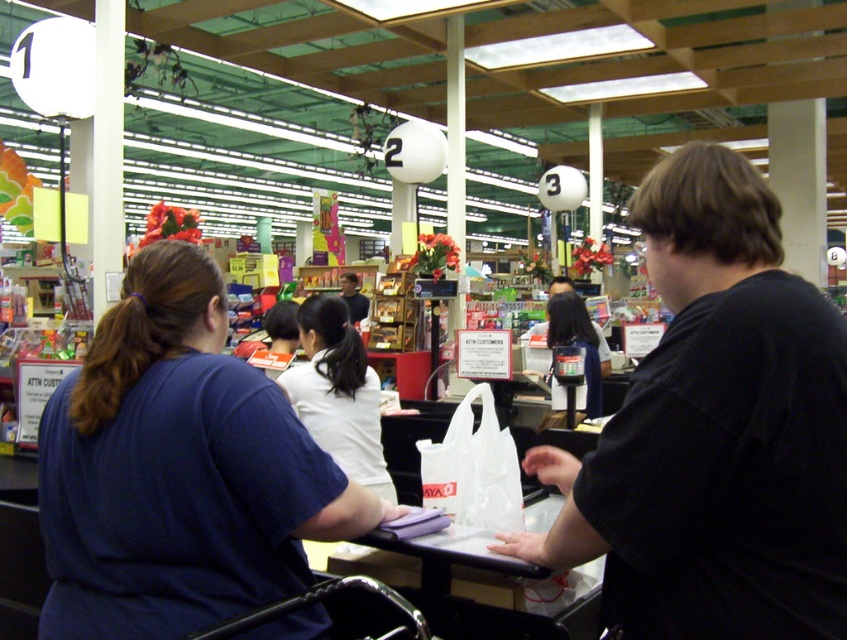
Question: Considering the real-world distances, which object is farthest from the black matte shirt at right?

Choices:
 (A) white matte shirt at center
 (B) matte black purse at center

Answer: (B)

Question: Estimate the real-world distances between objects in this image. Which object is closer to the blue cotton shirt at center?

Choices:
 (A) white matte shirt at center
 (B) matte black purse at center

Answer: (A)

Question: Can you confirm if black matte shirt at right is positioned above white matte shirt at center?

Choices:
 (A) no
 (B) yes

Answer: (B)

Question: Is black matte shirt at right positioned before blue cotton shirt at center?

Choices:
 (A) no
 (B) yes

Answer: (B)

Question: Is blue cotton shirt at center above matte black purse at center?

Choices:
 (A) yes
 (B) no

Answer: (B)

Question: Considering the real-world distances, which object is closest to the white matte shirt at center?

Choices:
 (A) blue cotton shirt at center
 (B) black matte shirt at right
 (C) matte black purse at center

Answer: (A)